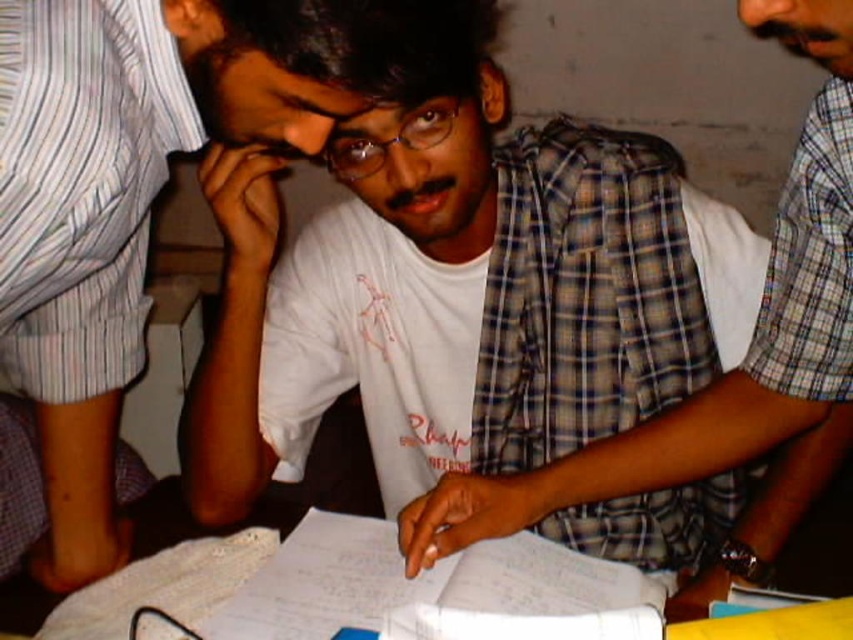
Question: Can you confirm if white matte shirt at center is thinner than plaid fabric shirt at center?

Choices:
 (A) no
 (B) yes

Answer: (B)

Question: Is white matte shirt at center to the right of white paper at center from the viewer's perspective?

Choices:
 (A) no
 (B) yes

Answer: (A)

Question: Which object appears closest to the camera in this image?

Choices:
 (A) white paper at center
 (B) white matte shirt at center

Answer: (A)

Question: Can you confirm if white matte shirt at center is bigger than plaid fabric shirt at center?

Choices:
 (A) no
 (B) yes

Answer: (A)

Question: Which of the following is the closest to the observer?

Choices:
 (A) white paper at center
 (B) white matte shirt at center
 (C) plaid fabric shirt at center

Answer: (C)

Question: Which object is closer to the camera taking this photo?

Choices:
 (A) plaid fabric shirt at center
 (B) white paper at center

Answer: (A)